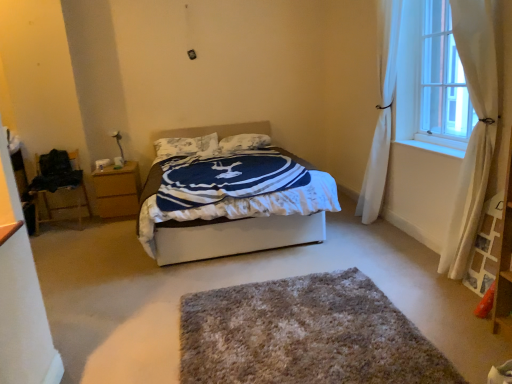
Where is `free area in between white soft bed at center and shaggy gray rug at center`? This screenshot has width=512, height=384. free area in between white soft bed at center and shaggy gray rug at center is located at coordinates (227, 288).